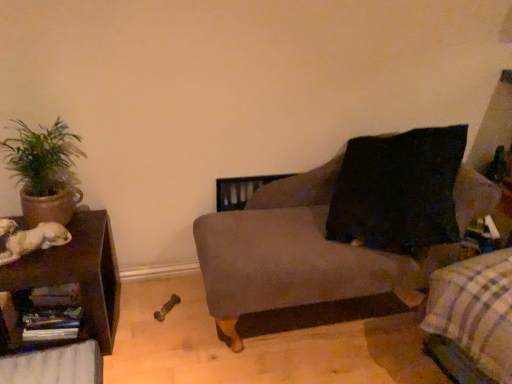
Where is `free space between wooden shelf at lower left and velvet gray couch at center`? free space between wooden shelf at lower left and velvet gray couch at center is located at coordinates (158, 326).